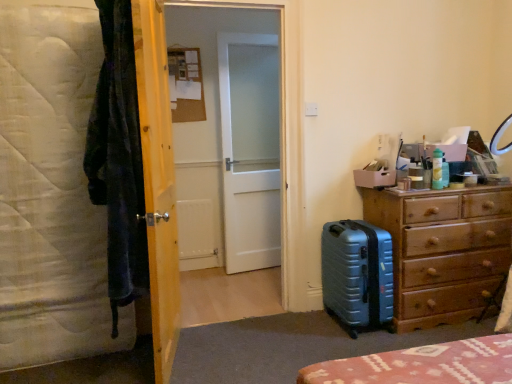
Question: Is green plastic bottle at upper right looking in the opposite direction of white frosted glass door at center, marked as the 1th screen door in a front-to-back arrangement?

Choices:
 (A) no
 (B) yes

Answer: (A)

Question: Does green plastic bottle at upper right have a larger size compared to white frosted glass door at center, marked as the 1th screen door in a front-to-back arrangement?

Choices:
 (A) no
 (B) yes

Answer: (A)

Question: From the image's perspective, is green plastic bottle at upper right located above white frosted glass door at center, marked as the 1th screen door in a front-to-back arrangement?

Choices:
 (A) yes
 (B) no

Answer: (B)

Question: Can you confirm if green plastic bottle at upper right is positioned to the right of white frosted glass door at center, which appears as the 2th screen door when viewed from the back?

Choices:
 (A) yes
 (B) no

Answer: (A)

Question: Is green plastic bottle at upper right smaller than white frosted glass door at center, which appears as the 2th screen door when viewed from the back?

Choices:
 (A) no
 (B) yes

Answer: (B)

Question: In terms of width, does wooden door at center look wider or thinner when compared to white frosted glass door at center, marked as the 1th screen door in a front-to-back arrangement?

Choices:
 (A) wide
 (B) thin

Answer: (B)

Question: From a real-world perspective, is wooden door at center physically located above or below white frosted glass door at center, marked as the 1th screen door in a front-to-back arrangement?

Choices:
 (A) below
 (B) above

Answer: (A)

Question: Is point coord(162,314) closer or farther from the camera than point coord(192,231)?

Choices:
 (A) closer
 (B) farther

Answer: (A)

Question: In the image, is wooden door at center on the left side or the right side of white frosted glass door at center, marked as the 1th screen door in a front-to-back arrangement?

Choices:
 (A) right
 (B) left

Answer: (B)

Question: Is metallic blue suitcase at lower right bigger or smaller than white matte screen door at center, which is the first screen door from back to front?

Choices:
 (A) small
 (B) big

Answer: (A)

Question: Relative to white matte screen door at center, the second screen door viewed from the front, is metallic blue suitcase at lower right in front or behind?

Choices:
 (A) behind
 (B) front

Answer: (B)

Question: Considering the positions of metallic blue suitcase at lower right and white matte screen door at center, the second screen door viewed from the front, in the image, is metallic blue suitcase at lower right wider or thinner than white matte screen door at center, the second screen door viewed from the front,?

Choices:
 (A) wide
 (B) thin

Answer: (A)

Question: From the image's perspective, relative to white matte screen door at center, the second screen door viewed from the front, is metallic blue suitcase at lower right above or below?

Choices:
 (A) above
 (B) below

Answer: (B)

Question: Considering their positions, is white quilted mattress at left located in front of or behind green plastic bottle at upper right?

Choices:
 (A) front
 (B) behind

Answer: (A)

Question: Does point (35, 195) appear closer or farther from the camera than point (433, 155)?

Choices:
 (A) farther
 (B) closer

Answer: (B)